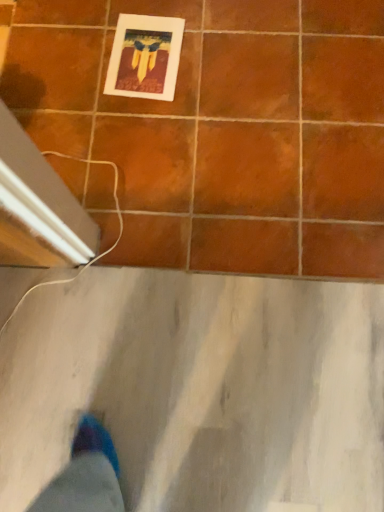
Locate an element on the screen. free point above smooth concrete at bottom (from a real-world perspective) is located at coordinates click(x=178, y=396).